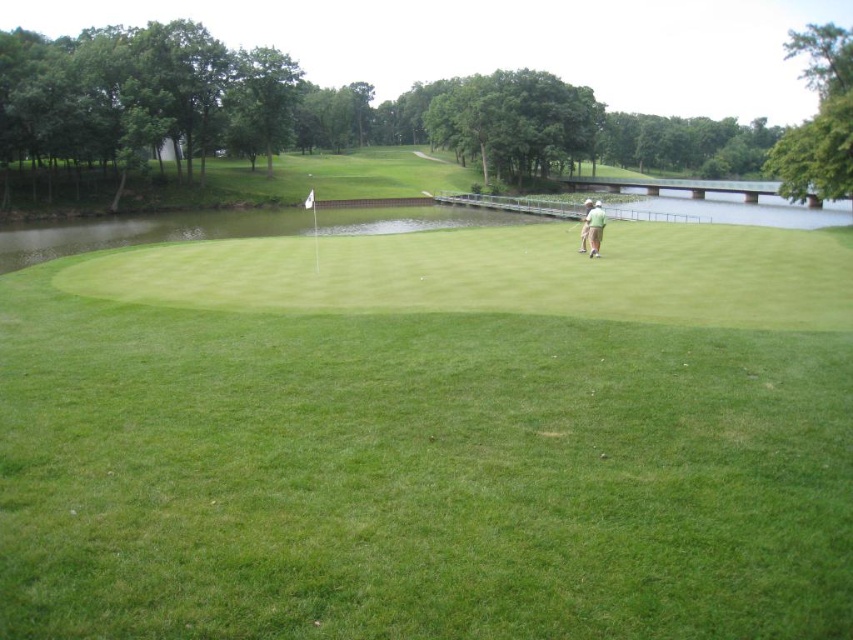
You are a golfer standing on the putting green and see the green fabric shirt at right and the metallic silver golf club at right. Which object is closer to you?

The green fabric shirt at right is closer to you because it is positioned over the metallic silver golf club at right, indicating it is in front.

You are a golfer standing on the putting green and see the green fabric shirt at right and the metallic silver golf club at right. Which object is closer to the right edge of the image?

The green fabric shirt at right is closer to the right edge of the image because it is positioned to the right of the metallic silver golf club at right.